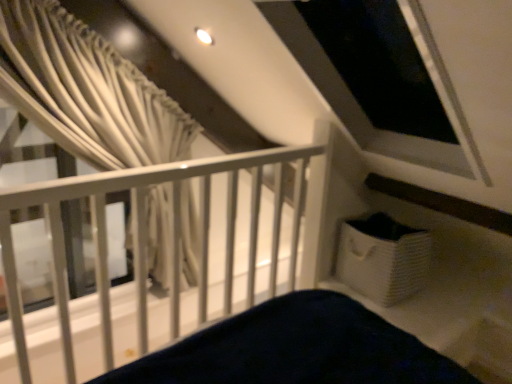
Question: Considering the positions of white matte rail at upper left and white fabric curtain at upper left in the image, is white matte rail at upper left bigger or smaller than white fabric curtain at upper left?

Choices:
 (A) big
 (B) small

Answer: (A)

Question: In terms of height, does white matte rail at upper left look taller or shorter compared to white fabric curtain at upper left?

Choices:
 (A) tall
 (B) short

Answer: (A)

Question: Is white matte rail at upper left to the left or to the right of white fabric curtain at upper left in the image?

Choices:
 (A) right
 (B) left

Answer: (A)

Question: In the image, is white fabric curtain at upper left on the left side or the right side of white matte rail at upper left?

Choices:
 (A) right
 (B) left

Answer: (B)

Question: Does point (185, 195) appear closer or farther from the camera than point (274, 249)?

Choices:
 (A) closer
 (B) farther

Answer: (A)

Question: Is white fabric curtain at upper left inside or outside of white matte rail at upper left?

Choices:
 (A) inside
 (B) outside

Answer: (B)

Question: Considering the positions of white fabric curtain at upper left and white matte rail at upper left in the image, is white fabric curtain at upper left wider or thinner than white matte rail at upper left?

Choices:
 (A) wide
 (B) thin

Answer: (B)